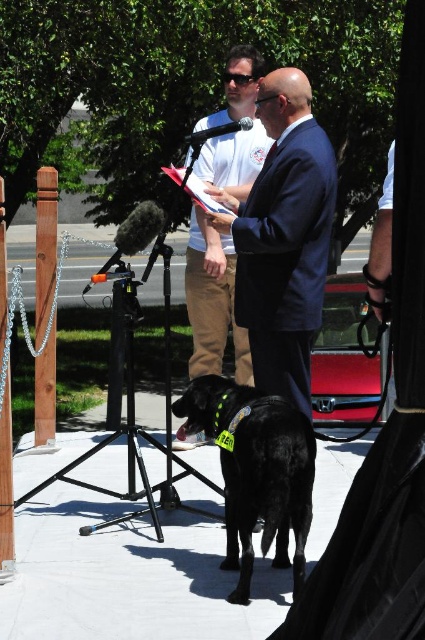
You are a photographer at the event and need to frame a photo that includes both the dark blue suit at center and the black matte dog at center. Given their sizes, which object should you adjust your camera focus to prioritize to ensure both fit in the frame?

The dark blue suit at center occupies less space than the black matte dog at center, so you should prioritize focusing on the black matte dog at center to ensure both fit in the frame.

You are a photographer positioned at the back of the stage. You want to take a photo of the dark blue suit at center and the black matte dog at center such that both are in focus. The camera you are using has a depth of field that can cover 30 inches. Can you capture both subjects clearly in the same photo?

The dark blue suit at center and the black matte dog at center are 30.69 inches apart. Since the camera can only cover 30 inches, the distance between them exceeds the depth of field capacity. Therefore, you cannot capture both subjects clearly in the same photo.

You are a photographer at the event and want to capture both the black matte dog at center and the white cotton shirt at center in the same frame. Which object should you focus on first to ensure both are in focus?

You should focus on the white cotton shirt at center first because the black matte dog at center is shorter than the white cotton shirt at center, so adjusting focus starting from the taller object will help capture both in the frame.